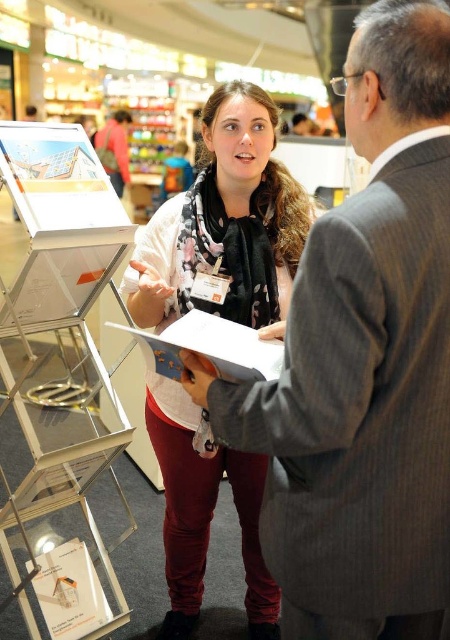
Question: Is floral scarf at center in front of white paper at center?

Choices:
 (A) yes
 (B) no

Answer: (B)

Question: Which point appears farthest from the camera in this image?

Choices:
 (A) (419, 486)
 (B) (175, 376)
 (C) (167, 611)

Answer: (C)

Question: Among these points, which one is farthest from the camera?

Choices:
 (A) (233, 100)
 (B) (359, 125)

Answer: (A)

Question: Based on their relative distances, which object is farther from the floral scarf at center?

Choices:
 (A) white paper at center
 (B) gray suit at center

Answer: (B)

Question: Does floral scarf at center appear over white paper at center?

Choices:
 (A) no
 (B) yes

Answer: (A)

Question: Can you confirm if gray suit at center is thinner than floral scarf at center?

Choices:
 (A) no
 (B) yes

Answer: (B)